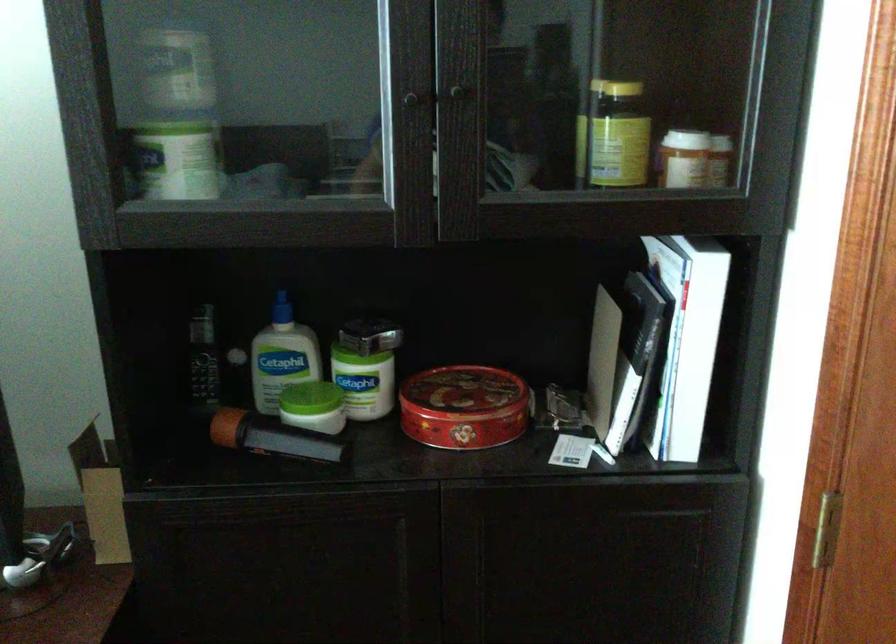
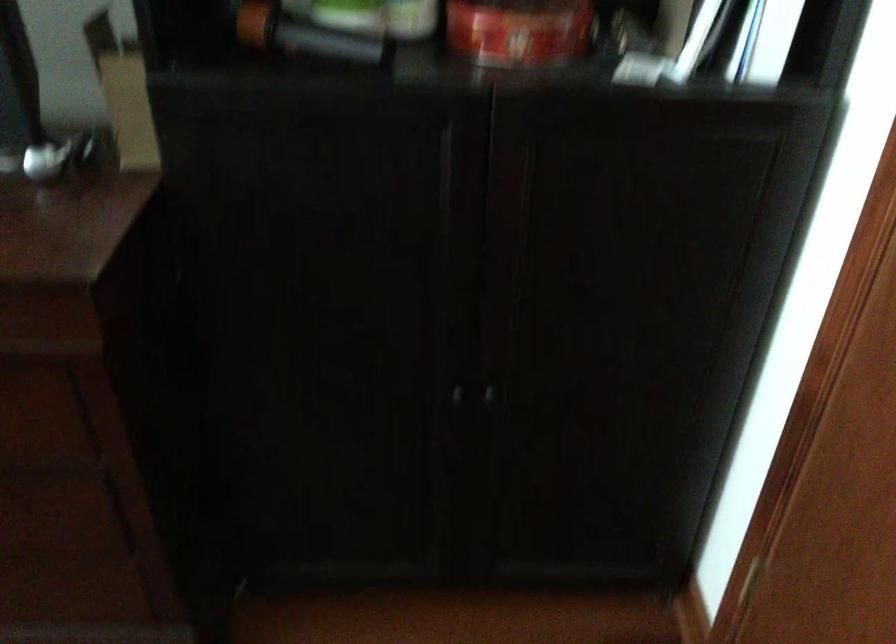
Where in the second image is the point corresponding to (x=462, y=430) from the first image?

(519, 31)